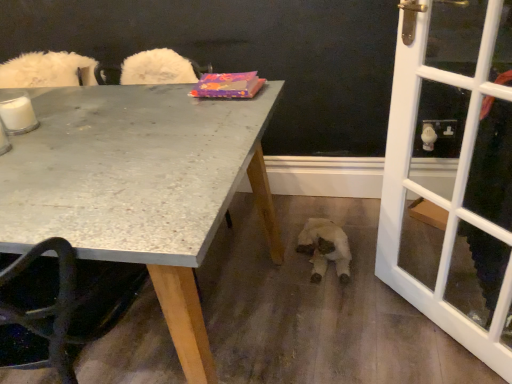
At what (x,y) coordinates should I click in order to perform the action: click on vacant space positioned to the left of white plush toy at lower center. Please return your answer as a coordinate pair (x, y). The height and width of the screenshot is (384, 512). Looking at the image, I should click on (254, 254).